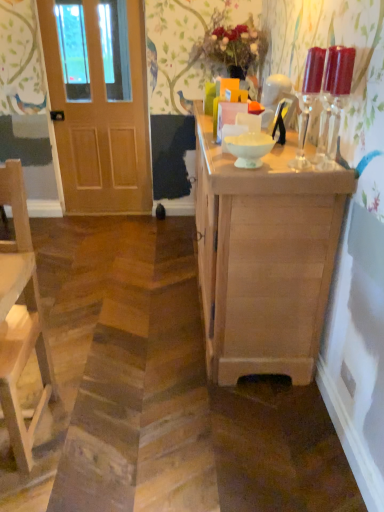
Question: Is light brown wooden chair at left at the right side of translucent glass candle holders at upper right, which appears as the 1th candle holder when viewed from the right?

Choices:
 (A) no
 (B) yes

Answer: (A)

Question: Is the depth of light brown wooden chair at left less than that of translucent glass candle holders at upper right, which appears as the 1th candle holder when viewed from the right?

Choices:
 (A) no
 (B) yes

Answer: (B)

Question: From a real-world perspective, is light brown wooden chair at left positioned under translucent glass candle holders at upper right, which appears as the 1th candle holder when viewed from the right, based on gravity?

Choices:
 (A) yes
 (B) no

Answer: (A)

Question: Is light brown wooden chair at left not within translucent glass candle holders at upper right, which appears as the 1th candle holder when viewed from the right?

Choices:
 (A) yes
 (B) no

Answer: (A)

Question: Is light brown wooden chair at left with translucent glass candle holders at upper right, acting as the second candle holder starting from the left?

Choices:
 (A) no
 (B) yes

Answer: (A)

Question: Is light brown wooden chair at left far away from translucent glass candle holders at upper right, acting as the second candle holder starting from the left?

Choices:
 (A) yes
 (B) no

Answer: (A)

Question: Is light brown wooden chair at left smaller than natural wood cabinet at center?

Choices:
 (A) yes
 (B) no

Answer: (A)

Question: Considering the relative positions of light brown wooden chair at left and natural wood cabinet at center in the image provided, is light brown wooden chair at left to the left of natural wood cabinet at center from the viewer's perspective?

Choices:
 (A) yes
 (B) no

Answer: (A)

Question: Is light brown wooden chair at left shorter than natural wood cabinet at center?

Choices:
 (A) no
 (B) yes

Answer: (A)

Question: From the image's perspective, does light brown wooden chair at left appear lower than natural wood cabinet at center?

Choices:
 (A) yes
 (B) no

Answer: (A)

Question: Is the depth of light brown wooden chair at left less than that of natural wood cabinet at center?

Choices:
 (A) yes
 (B) no

Answer: (A)

Question: Is natural wood cabinet at center located within light brown wooden chair at left?

Choices:
 (A) yes
 (B) no

Answer: (B)

Question: Does wooden door at left lie behind white glossy bowl at center?

Choices:
 (A) yes
 (B) no

Answer: (A)